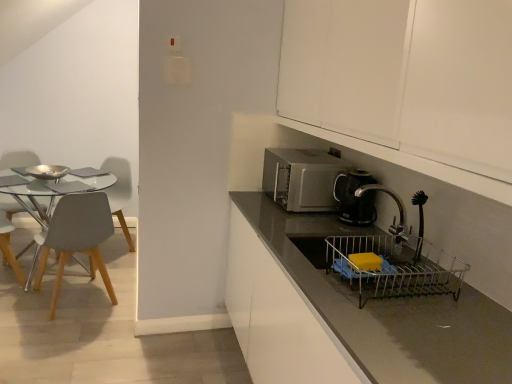
Question: Can you confirm if white matte cabinet at upper right is smaller than matte gray chair at left, arranged as the 2th chair when viewed from the right?

Choices:
 (A) yes
 (B) no

Answer: (B)

Question: Is white matte cabinet at upper right facing away from matte gray chair at left, the 3th chair in the left-to-right sequence?

Choices:
 (A) no
 (B) yes

Answer: (A)

Question: Is white matte cabinet at upper right oriented towards matte gray chair at left, the 3th chair in the left-to-right sequence?

Choices:
 (A) yes
 (B) no

Answer: (B)

Question: Are white matte cabinet at upper right and matte gray chair at left, the 3th chair in the left-to-right sequence, beside each other?

Choices:
 (A) yes
 (B) no

Answer: (B)

Question: From a real-world perspective, does white matte cabinet at upper right stand above matte gray chair at left, the 3th chair in the left-to-right sequence?

Choices:
 (A) no
 (B) yes

Answer: (B)

Question: From the image's perspective, is light gray wood chair at left, acting as the fourth chair starting from the right, located above or below shiny silver bowl at left?

Choices:
 (A) below
 (B) above

Answer: (A)

Question: Is light gray wood chair at left, acting as the fourth chair starting from the right, bigger or smaller than shiny silver bowl at left?

Choices:
 (A) big
 (B) small

Answer: (A)

Question: Choose the correct answer: Is light gray wood chair at left, acting as the fourth chair starting from the right, inside shiny silver bowl at left or outside it?

Choices:
 (A) outside
 (B) inside

Answer: (A)

Question: From their relative heights in the image, would you say light gray wood chair at left, the 1th chair when ordered from left to right, is taller or shorter than shiny silver bowl at left?

Choices:
 (A) short
 (B) tall

Answer: (B)

Question: From the image's perspective, is shiny silver bowl at left located above or below light gray wood chair at left, the 1th chair when ordered from left to right?

Choices:
 (A) above
 (B) below

Answer: (A)

Question: In terms of width, does shiny silver bowl at left look wider or thinner when compared to light gray wood chair at left, the 1th chair when ordered from left to right?

Choices:
 (A) wide
 (B) thin

Answer: (B)

Question: Relative to light gray wood chair at left, the 1th chair when ordered from left to right, is shiny silver bowl at left in front or behind?

Choices:
 (A) front
 (B) behind

Answer: (A)

Question: From a real-world perspective, is shiny silver bowl at left physically located above or below light gray wood chair at left, acting as the fourth chair starting from the right?

Choices:
 (A) below
 (B) above

Answer: (B)

Question: Is light gray plastic chair at left, the 4th chair from the left, taller or shorter than matte gray countertop at center?

Choices:
 (A) short
 (B) tall

Answer: (A)

Question: Is light gray plastic chair at left, the first chair positioned from the right, inside or outside of matte gray countertop at center?

Choices:
 (A) inside
 (B) outside

Answer: (B)